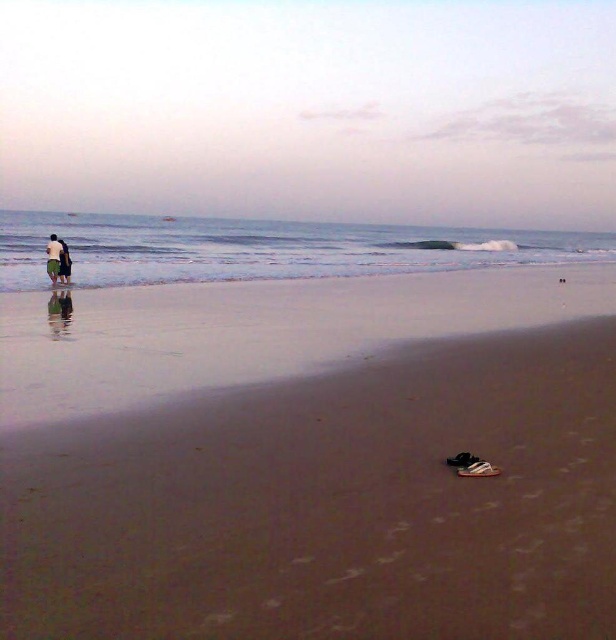
You are standing on the beach and want to walk to the blue water at upper center without getting your dark green shorts at left wet. Which direction should you walk to avoid stepping into the water?

You should walk towards the blue water at upper center because it is closer to you than the dark green shorts at left, so moving towards it would not put the shorts in the water.

You are a photographer setting up a tripod to capture the beach scene. You want to place the dark green shorts at left and white cotton shirt at left in the frame such that they are closer together than 4 inches apart. Based on the scene, can you achieve this?

The dark green shorts at left and white cotton shirt at left are already 3.49 inches apart, which is less than 4 inches. Therefore, they can be placed in the frame as desired.

You are standing on the beach and want to know if the blue water at upper center is wider than the white cotton shirt at left. Can you determine this based on the scene?

The blue water at upper center might be wider than the white cotton shirt at left according to the scene description.